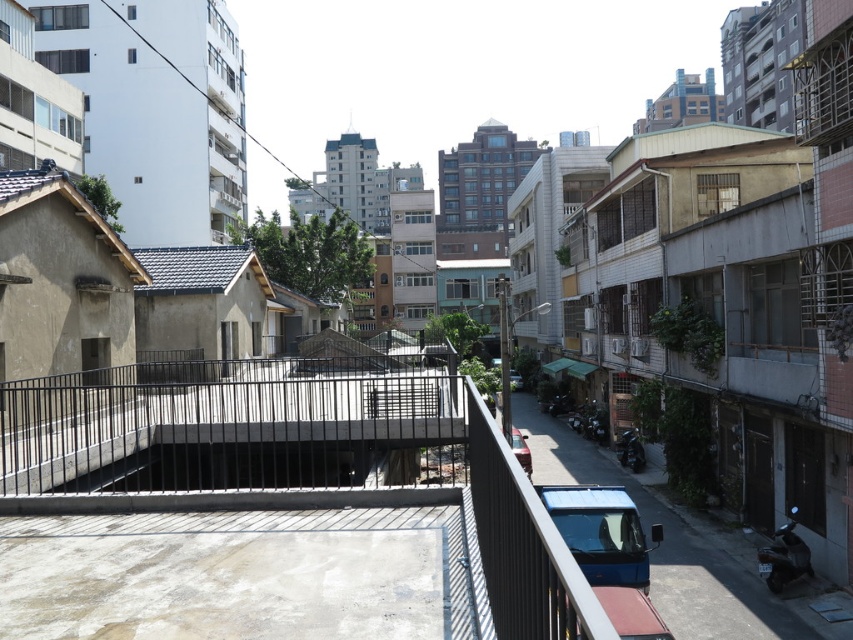
You are a delivery person trying to navigate a narrow alleyway between buildings. You need to deliver a package to a location behind the black metal railing at center. The blue metallic van at lower right is blocking the path. Can you safely maneuver around the van to reach the railing? The alleyway is only 5 meters wide. The van is 4 meters long and 2 meters wide. The delivery vehicle you are driving is 3 meters long and 1.8 meters wide. The minimum turning radius for your vehicle is 5 meters. Can you fit?

The distance between the black metal railing at center and the blue metallic van at lower right is 4.56 meters. The alleyway is 5 meters wide. The van is 2 meters wide, leaving 3 meters of space. Your vehicle is 1.8 meters wide, so there is enough space. However, the van is blocking the path. To maneuver around, you need to consider the turning radius. Since the minimum turning radius is 5 meters and the alley is 5 meters wide, you can make the turn safely. Therefore, yes, you can fit by going around thevan

Looking at this image, you are a delivery person trying to navigate a narrow alleyway between buildings. You see a black metal railing at center and a blue metallic van at lower right. Which object is bigger in size?

The black metal railing at center has a larger size compared to the blue metallic van at lower right.

You are a delivery driver trying to navigate through the alleyway between the two buildings. You see a metallic silver car at center and a silver metallic car at center. Can you safely pass between them if your delivery van is 2 meters wide?

The distance between the metallic silver car at center and the silver metallic car at center is 22.00 meters. Since your van is only 2 meters wide, there is ample space to safely pass between them.